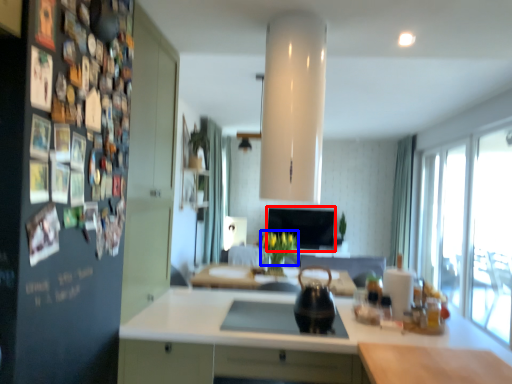
Question: Which object appears closest to the camera in this image, window screen (highlighted by a red box) or flower (highlighted by a blue box)?

Choices:
 (A) window screen
 (B) flower

Answer: (B)